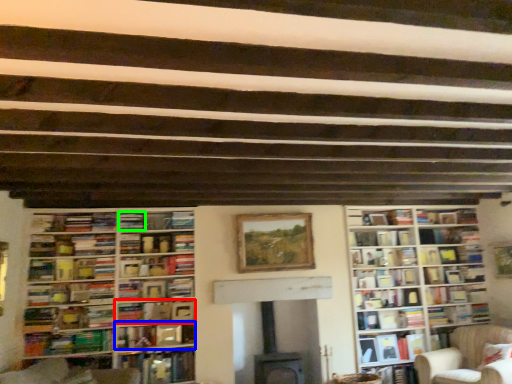
Question: Considering the real-world distances, which object is farthest from book (highlighted by a red box)? book (highlighted by a blue box) or book (highlighted by a green box)?

Choices:
 (A) book
 (B) book

Answer: (B)